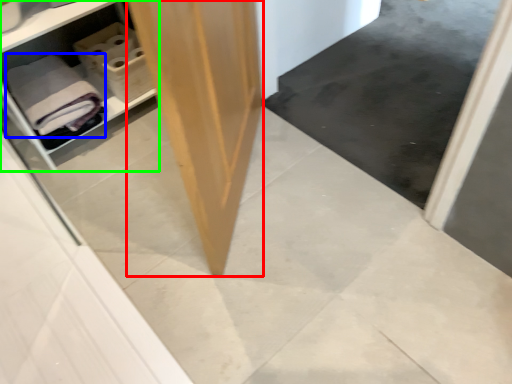
Question: Which object is the closest to the plywood (highlighted by a red box)? Choose among these: bath towel (highlighted by a blue box) or shelf (highlighted by a green box).

Choices:
 (A) bath towel
 (B) shelf

Answer: (A)